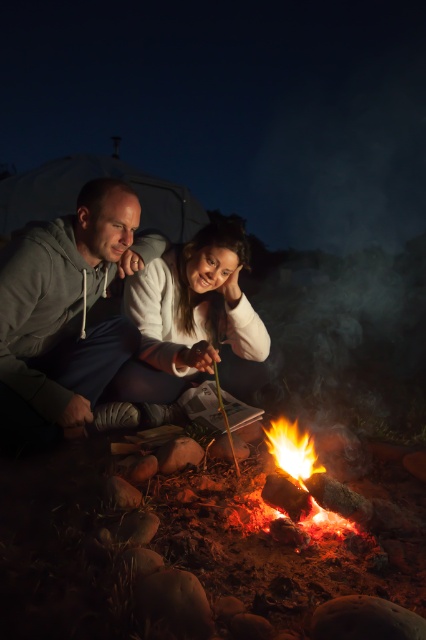
You are a photographer standing in front of the campfire scene. You want to take a photo of the gray hoodie at left and the flaming wood at center. Which object is closer to you as you take the photo?

The gray hoodie at left is closer to you than the flaming wood at center because it is further to the viewer.

You are planning to place a new decorative item between the white soft sweater at center and the flaming wood at center in the campfire scene. Considering their sizes, which object should you place the item closer to to ensure it doesn

The white soft sweater at center is wider than the flaming wood at center. Therefore, placing the decorative item closer to the flaming wood at center would ensure there is enough space between them.

You are standing in front of the campfire scene. There are two points marked in the image. The first point is at coordinates point (x=138, y=397) and the second point is at point (x=354, y=499). Which of these two points is closer to you?

Point (x=138, y=397) is closer to you because it is further to the camera than point (x=354, y=499).